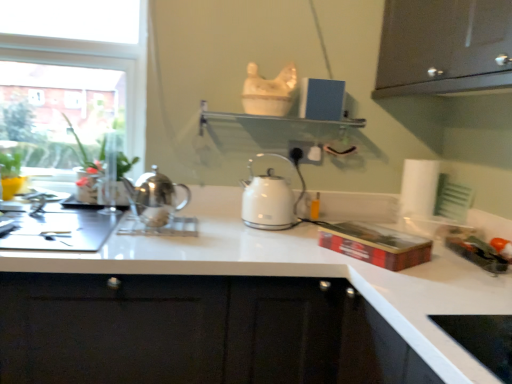
Question: Considering the relative sizes of white glossy shelf at upper center and green glossy plant at left in the image provided, is white glossy shelf at upper center bigger than green glossy plant at left?

Choices:
 (A) yes
 (B) no

Answer: (B)

Question: Can you confirm if white glossy shelf at upper center is shorter than green glossy plant at left?

Choices:
 (A) yes
 (B) no

Answer: (A)

Question: From a real-world perspective, is white glossy shelf at upper center positioned under green glossy plant at left based on gravity?

Choices:
 (A) yes
 (B) no

Answer: (B)

Question: Does white glossy shelf at upper center have a lesser width compared to green glossy plant at left?

Choices:
 (A) no
 (B) yes

Answer: (B)

Question: Would you say white glossy shelf at upper center is a long distance from green glossy plant at left?

Choices:
 (A) no
 (B) yes

Answer: (A)

Question: In the image, is white plastic electric outlet at center positioned in front of or behind transparent glass window at upper left?

Choices:
 (A) behind
 (B) front

Answer: (A)

Question: Would you say white plastic electric outlet at center is inside or outside transparent glass window at upper left?

Choices:
 (A) inside
 (B) outside

Answer: (B)

Question: In the image, is white plastic electric outlet at center on the left side or the right side of transparent glass window at upper left?

Choices:
 (A) left
 (B) right

Answer: (B)

Question: In terms of size, does white plastic electric outlet at center appear bigger or smaller than transparent glass window at upper left?

Choices:
 (A) big
 (B) small

Answer: (B)

Question: Based on their positions, is green glossy plant at left located to the left or right of white paper towel at right?

Choices:
 (A) right
 (B) left

Answer: (B)

Question: Looking at their shapes, would you say green glossy plant at left is wider or thinner than white paper towel at right?

Choices:
 (A) thin
 (B) wide

Answer: (B)

Question: From the image's perspective, is green glossy plant at left positioned above or below white paper towel at right?

Choices:
 (A) above
 (B) below

Answer: (A)

Question: Considering their positions, is green glossy plant at left located in front of or behind white paper towel at right?

Choices:
 (A) front
 (B) behind

Answer: (A)

Question: Is white glossy kettle at center, placed as the 1th kettle when sorted from back to front, wider or thinner than transparent glass window at upper left?

Choices:
 (A) thin
 (B) wide

Answer: (B)

Question: Is white glossy kettle at center, placed as the first kettle when sorted from right to left, taller or shorter than transparent glass window at upper left?

Choices:
 (A) tall
 (B) short

Answer: (B)